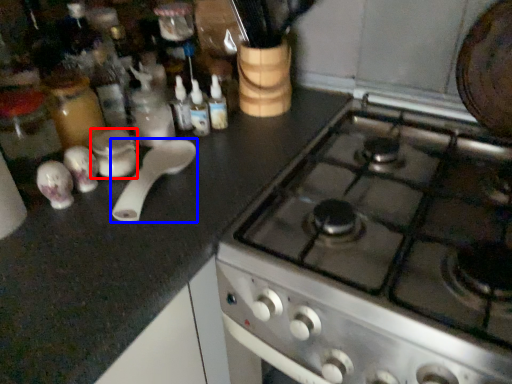
Question: Which of the following is the farthest to the observer, appliance (highlighted by a red box) or kitchen appliance (highlighted by a blue box)?

Choices:
 (A) appliance
 (B) kitchen appliance

Answer: (A)